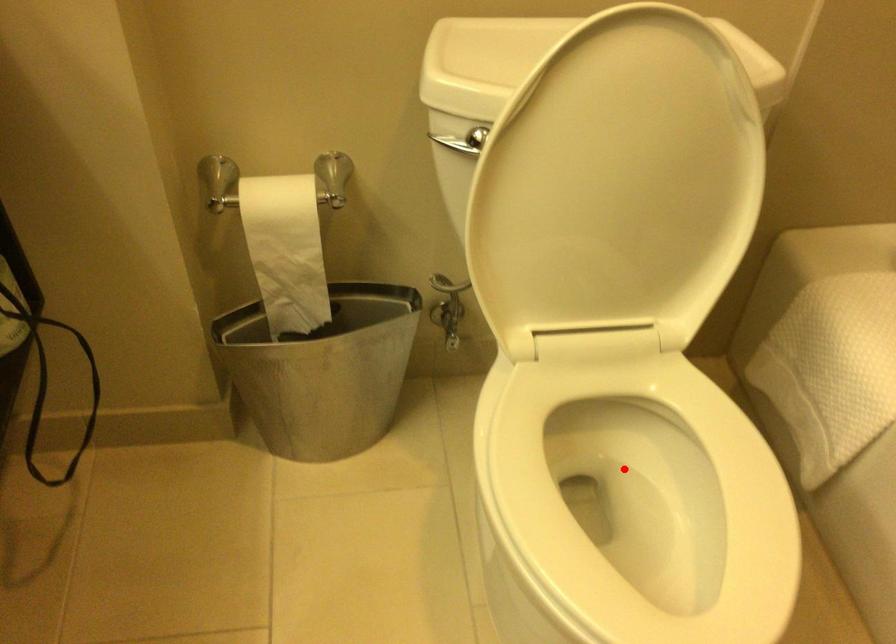
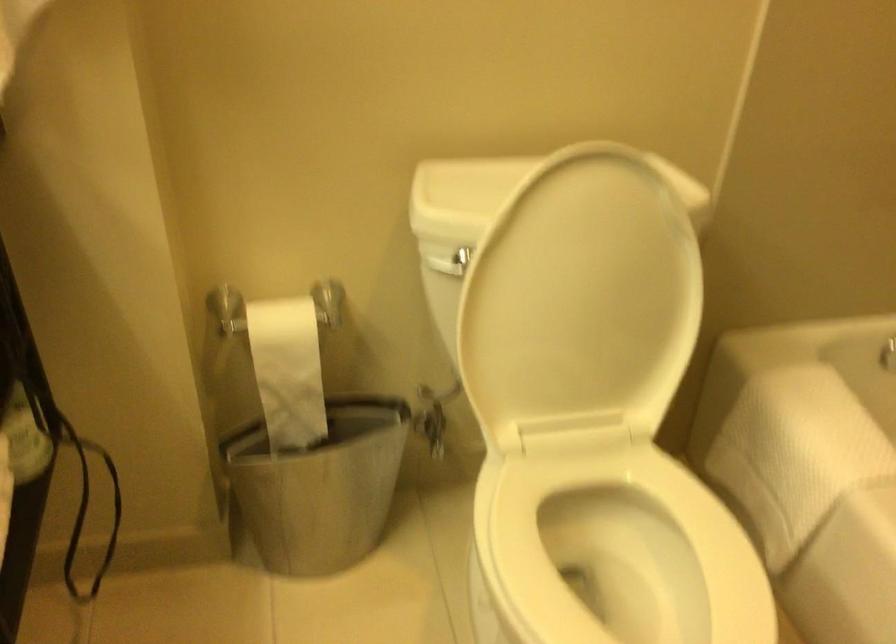
In the second image, find the point that corresponds to the highlighted location in the first image.

(607, 554)